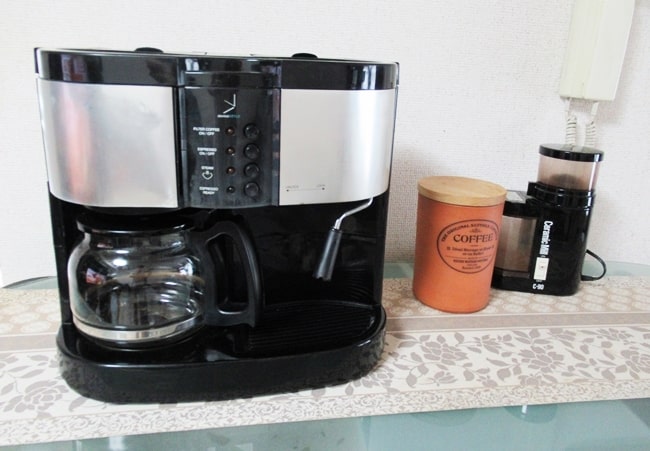
I want to click on counter top edge, so click(502, 398).